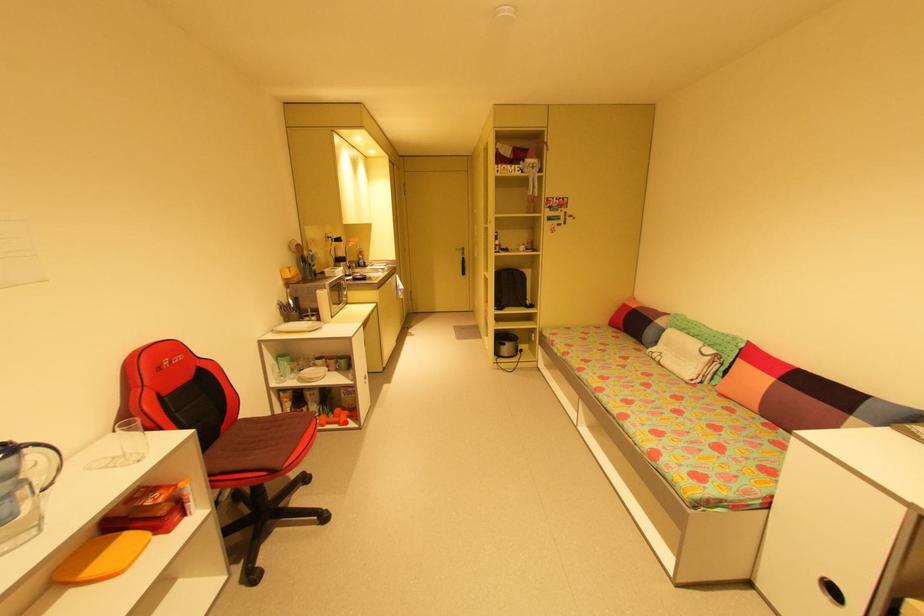
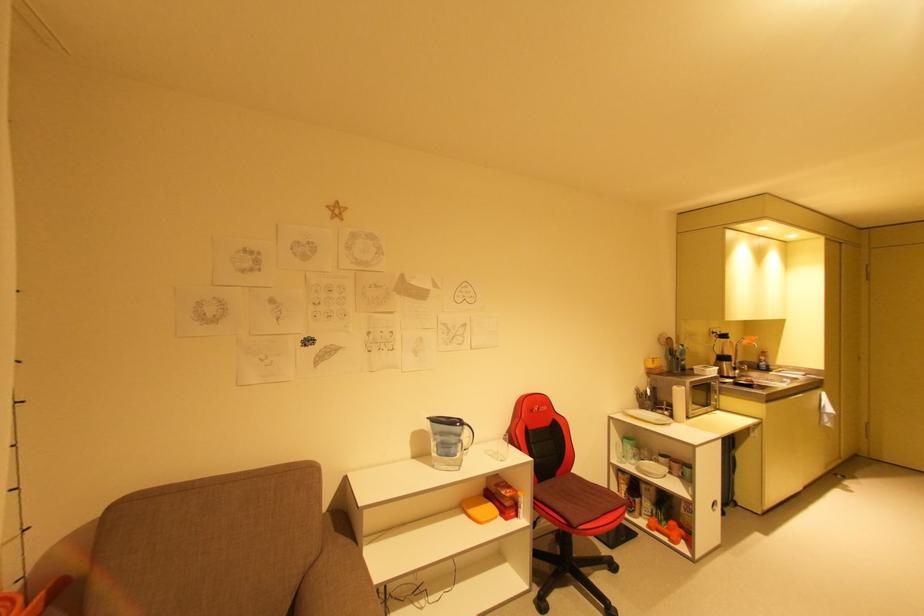
Where in the second image is the point corresponding to the highlighted location from the first image?

(675, 538)